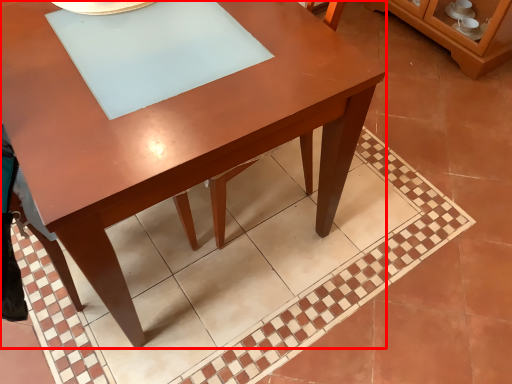
Question: From the image, what is the correct spatial relationship of table (annotated by the red box) in relation to dresser?

Choices:
 (A) left
 (B) right

Answer: (A)